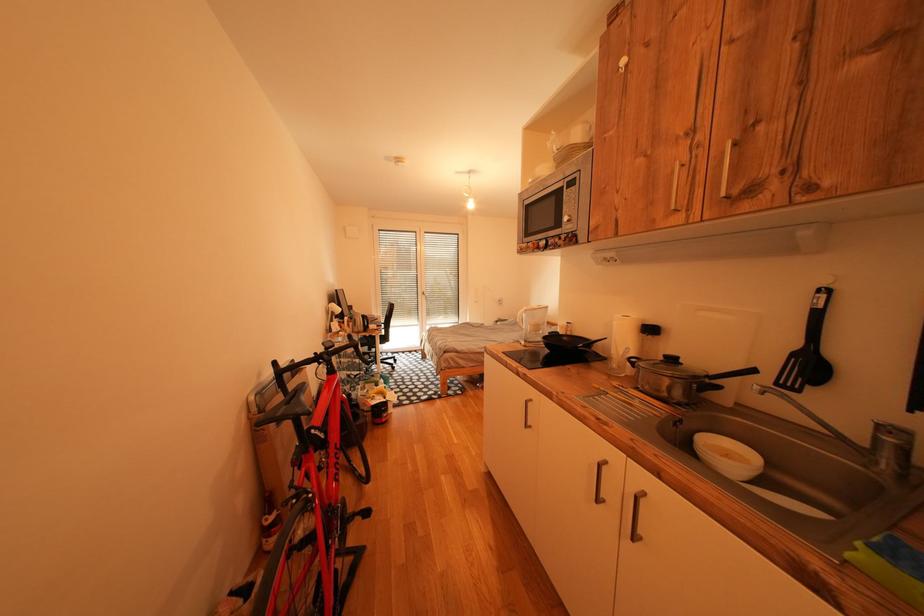
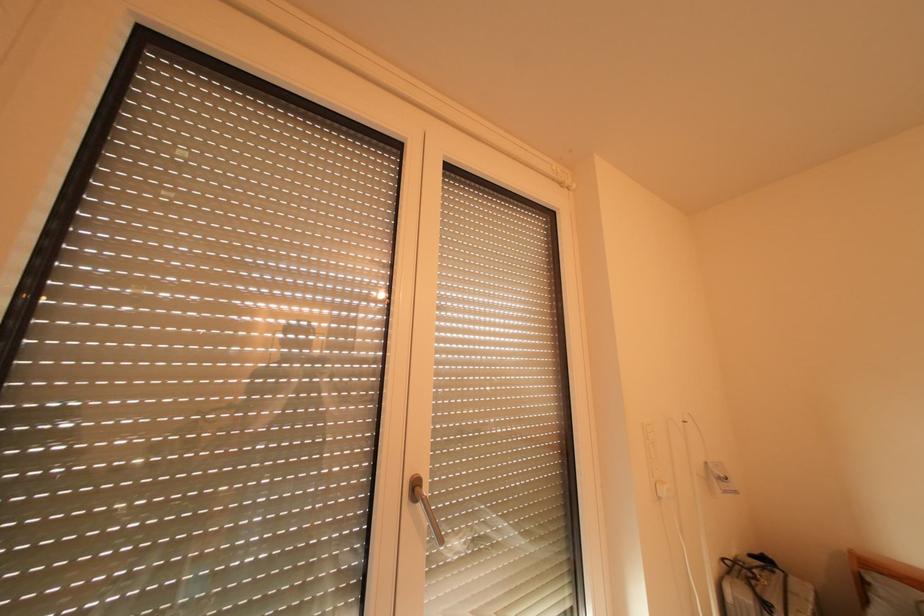
Question: What movement of the cameraman would produce the second image?

Choices:
 (A) Left
 (B) Right
 (C) Forward
 (D) Backward

Answer: (C)